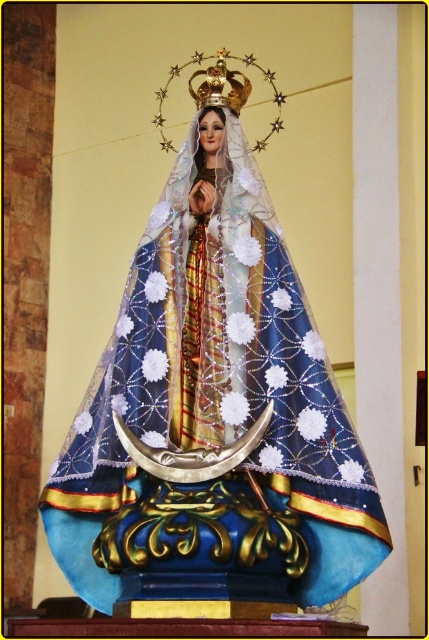
Question: Where is blue fabric statue at center located in relation to gold metallic crown at upper center in the image?

Choices:
 (A) right
 (B) left

Answer: (B)

Question: Does blue fabric statue at center appear under gold metallic crown at upper center?

Choices:
 (A) yes
 (B) no

Answer: (A)

Question: Observing the image, what is the correct spatial positioning of blue fabric statue at center in reference to gold metallic crown at upper center?

Choices:
 (A) below
 (B) above

Answer: (A)